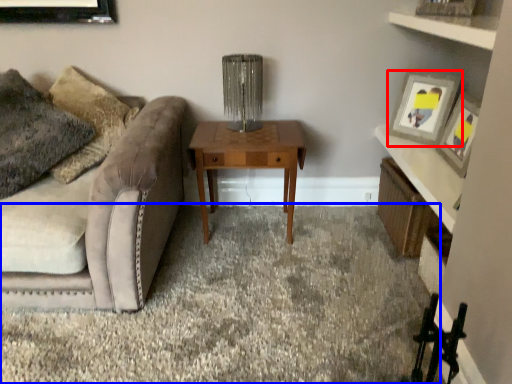
Question: Which object is further to the camera taking this photo, picture frame (highlighted by a red box) or plain (highlighted by a blue box)?

Choices:
 (A) picture frame
 (B) plain

Answer: (A)